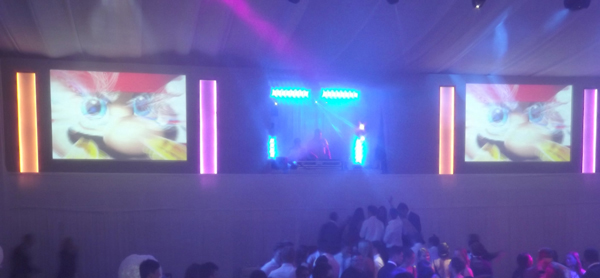
You are a GUI agent. You are given a task and a screenshot of the screen. Output one action in this format:
    pyautogui.click(x=<x>, y=<y>)
    Task: Click on the wall
    The height and width of the screenshot is (278, 600).
    Given the screenshot: What is the action you would take?
    pyautogui.click(x=254, y=222)